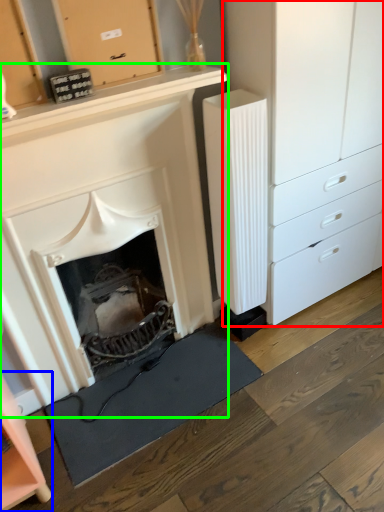
Question: Which is farther away from chest of drawers (highlighted by a red box)? cabinetry (highlighted by a blue box) or fireplace (highlighted by a green box)?

Choices:
 (A) cabinetry
 (B) fireplace

Answer: (A)